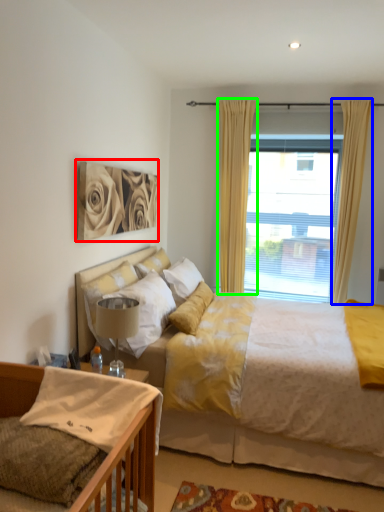
Question: Which object is the closest to the picture frame (highlighted by a red box)? Choose among these: curtain (highlighted by a blue box) or curtain (highlighted by a green box).

Choices:
 (A) curtain
 (B) curtain

Answer: (B)